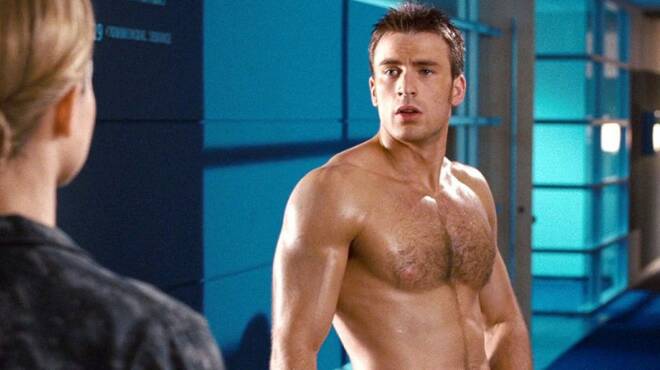
The width and height of the screenshot is (660, 370). Identify the location of wall. (160, 200).